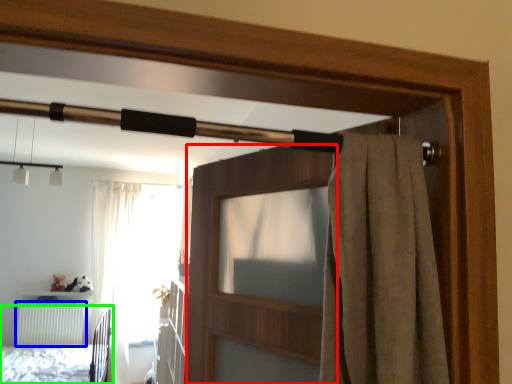
Question: Which object is positioned farthest from screen door (highlighted by a red box)? Select from radiator (highlighted by a blue box) and bed (highlighted by a green box).

Choices:
 (A) radiator
 (B) bed

Answer: (A)